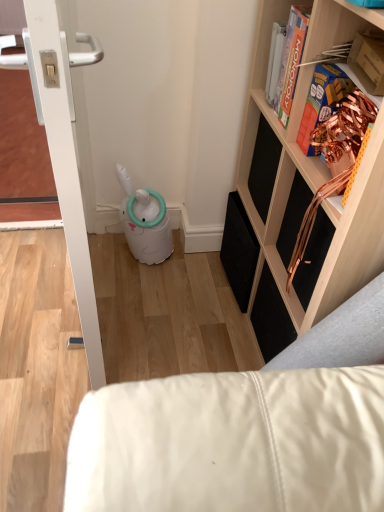
Question: Relative to orange matte monopoly board game at upper right, which is the second book from bottom to top, is white leather couch at lower right in front or behind?

Choices:
 (A) front
 (B) behind

Answer: (A)

Question: From the image's perspective, relative to orange matte monopoly board game at upper right, which is the second book from bottom to top, is white leather couch at lower right above or below?

Choices:
 (A) above
 (B) below

Answer: (B)

Question: Which of these objects is positioned farthest from the orange matte monopoly board game at upper right, placed as the 2th book when sorted from front to back?

Choices:
 (A) copper foil book at upper right, arranged as the first book when ordered from the bottom
 (B) white leather couch at lower right
 (C) wooden/black speaker at upper right
 (D) white glossy door at left

Answer: (B)

Question: Estimate the real-world distances between objects in this image. Which object is closer to the orange matte monopoly board game at upper right, which is the first book from top to bottom?

Choices:
 (A) wooden/black speaker at upper right
 (B) copper foil book at upper right, the second book from the back
 (C) white leather couch at lower right
 (D) white glossy door at left

Answer: (B)